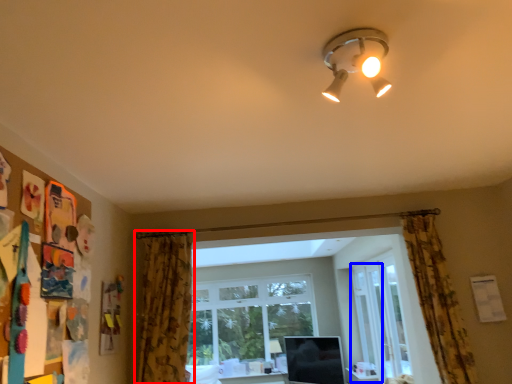
Question: Which object appears farthest to the camera in this image, curtain (highlighted by a red box) or screen door (highlighted by a blue box)?

Choices:
 (A) curtain
 (B) screen door

Answer: (B)